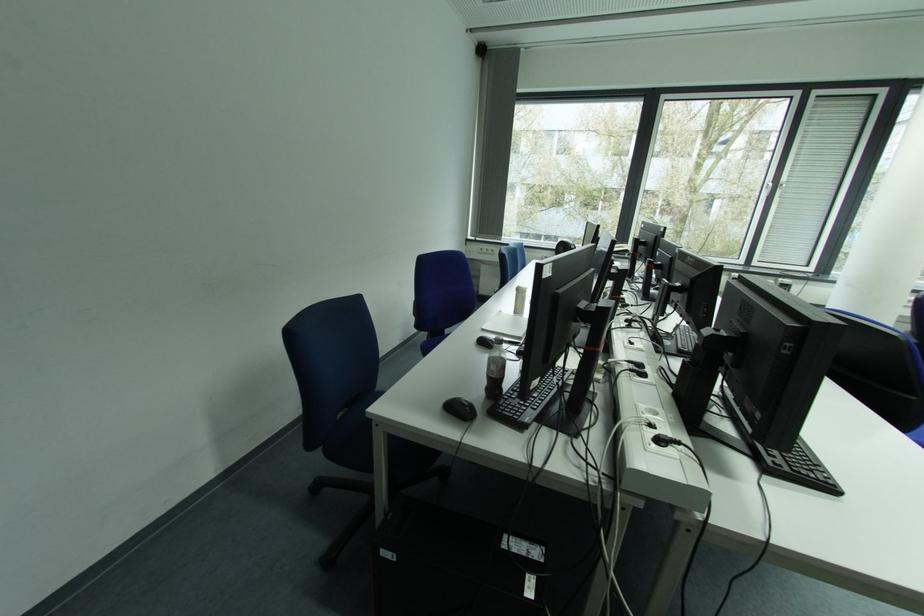
Find where to plugg the power strip socket. Please return your answer as a coordinate pair (x, y).

(523, 546)